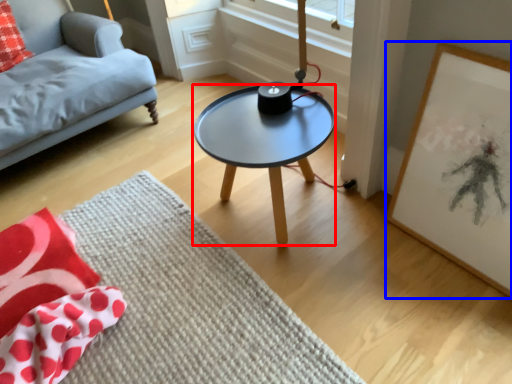
Question: Among these objects, which one is farthest to the camera, coffee table (highlighted by a red box) or picture frame (highlighted by a blue box)?

Choices:
 (A) coffee table
 (B) picture frame

Answer: (A)